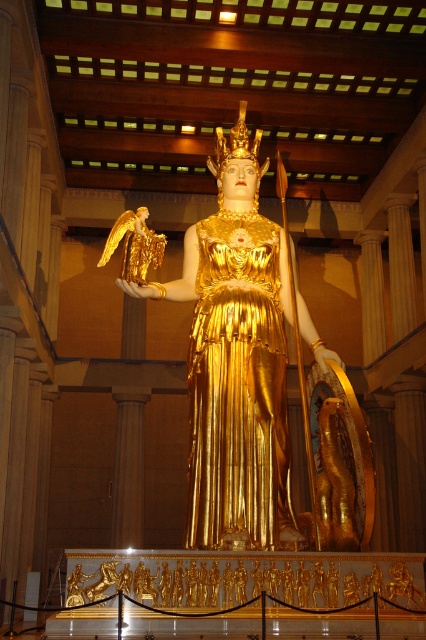
You are an interior designer assessing the placement of the gold metallic angel at upper left and the gold textured crown at center in the grand hall. Based on their positions, which object is positioned further to the left?

The gold metallic angel at upper left is positioned further to the left compared to the gold textured crown at center, as it is located to the left of the crown.